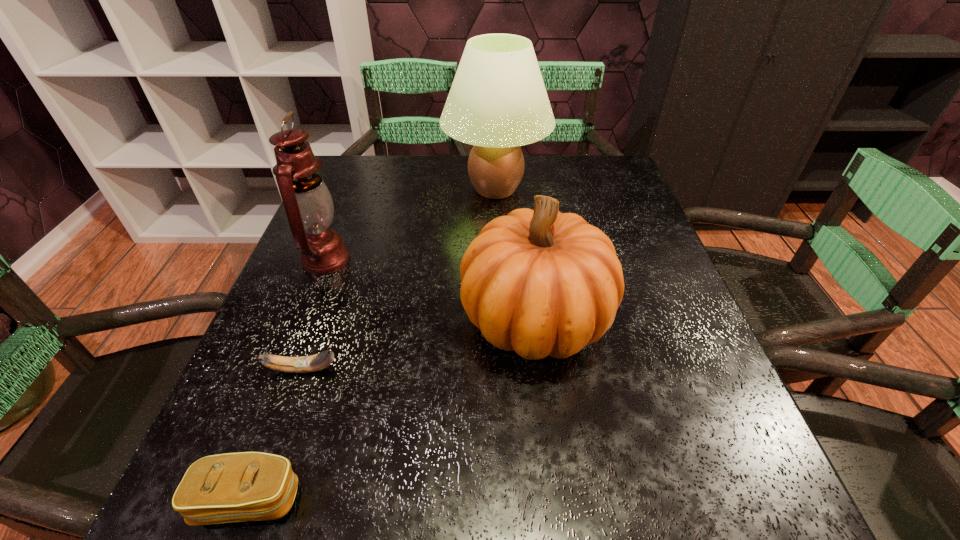
Find the location of `vacant space at the left edge of the desktop`. vacant space at the left edge of the desktop is located at coordinates (272, 330).

In the image, there is a desktop. Identify the location of free space at the right edge. The height and width of the screenshot is (540, 960). (630, 228).

Locate an element on the screen. Image resolution: width=960 pixels, height=540 pixels. free space at the far left corner is located at coordinates (381, 161).

In the image, there is a desktop. At what (x,y) coordinates should I click in order to perform the action: click on vacant space at the far right corner. Please return your answer as a coordinate pair (x, y). Looking at the image, I should click on (581, 168).

Find the location of `vacant space at the near right corner of the desktop`. vacant space at the near right corner of the desktop is located at coordinates (708, 475).

Identify the location of free space between the oil lamp and the banana. (315, 314).

Find the location of `free area in between the farthest object and the banana`. free area in between the farthest object and the banana is located at coordinates (399, 279).

Image resolution: width=960 pixels, height=540 pixels. I want to click on free space between the oil lamp and the nearest object, so click(287, 380).

This screenshot has width=960, height=540. What are the coordinates of `empty space that is in between the oil lamp and the banana` in the screenshot? It's located at (315, 314).

You are a GUI agent. You are given a task and a screenshot of the screen. Output one action in this format:
    pyautogui.click(x=<x>, y=<y>)
    Task: Click on the unoccupied position between the oil lamp and the pumpkin
    The height and width of the screenshot is (540, 960).
    Given the screenshot: What is the action you would take?
    pyautogui.click(x=431, y=289)